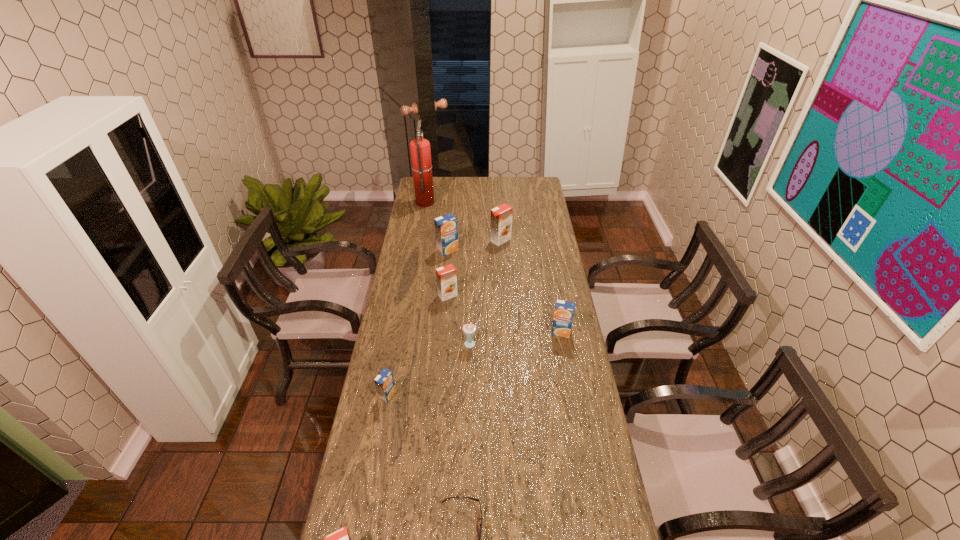
I want to click on empty space that is in between the farthest blue orange_juice and the milkshake, so click(460, 297).

Locate an element on the screen. The height and width of the screenshot is (540, 960). free space that is in between the nearest blue orange_juice and the fifth orange juice from left to right is located at coordinates (444, 318).

The image size is (960, 540). In order to click on object that is the second nearest to the second farthest orange orange juice in this screenshot , I will do `click(446, 227)`.

Locate an element on the screen. This screenshot has height=540, width=960. the second closest object to the tallest object is located at coordinates (501, 216).

Identify the location of orange juice that is the third closest to the smallest orange orange juice. The width and height of the screenshot is (960, 540). (564, 311).

Find the location of a particular element. The image size is (960, 540). orange juice that stands as the closest to the leftmost orange orange juice is located at coordinates (384, 382).

Choose which orange orange juice is the third nearest neighbor to the leftmost blue orange_juice. Please provide its 2D coordinates. Your answer should be formatted as a tuple, i.e. [(x, y)], where the tuple contains the x and y coordinates of a point satisfying the conditions above.

[(501, 216)]

Locate which orange orange juice is the third closest to the fifth farthest orange juice. Please provide its 2D coordinates. Your answer should be formatted as a tuple, i.e. [(x, y)], where the tuple contains the x and y coordinates of a point satisfying the conditions above.

[(501, 216)]

This screenshot has height=540, width=960. In order to click on blue orange_juice that can be found as the closest to the leftmost orange orange juice in this screenshot , I will do `click(384, 382)`.

Select which blue orange_juice appears as the second closest to the farthest blue orange_juice. Please provide its 2D coordinates. Your answer should be formatted as a tuple, i.e. [(x, y)], where the tuple contains the x and y coordinates of a point satisfying the conditions above.

[(384, 382)]